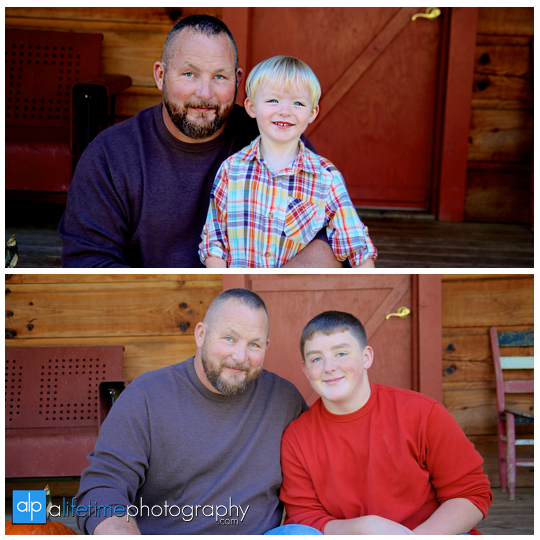
Find the location of a particular element. red painted wooden chair is located at coordinates (502, 415).